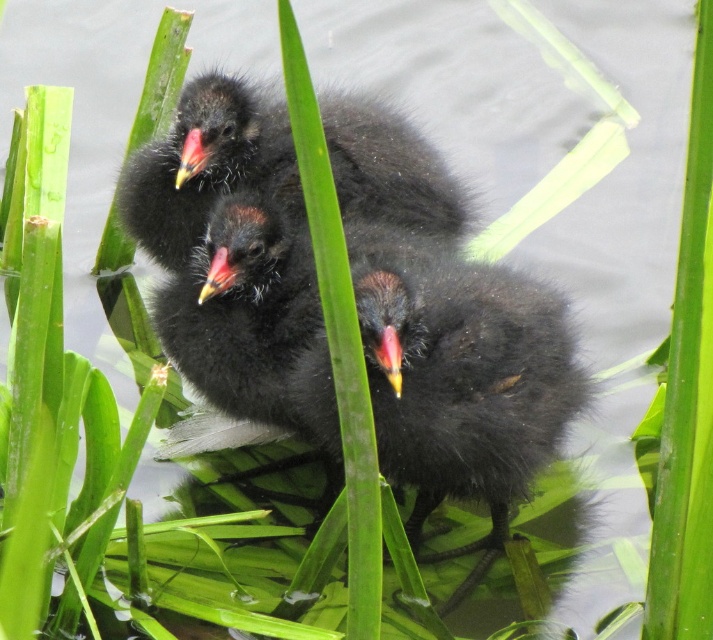
Question: Does black fluffy birds at upper center appear over yellow-orange beak at center?

Choices:
 (A) no
 (B) yes

Answer: (B)

Question: In this image, where is black fluffy birds at upper center located relative to yellow-orange beak at center?

Choices:
 (A) above
 (B) below

Answer: (A)

Question: Among these points, which one is nearest to the camera?

Choices:
 (A) (389, 376)
 (B) (381, 145)

Answer: (A)

Question: Which of the following is the farthest from the observer?

Choices:
 (A) black fluffy birds at upper center
 (B) yellow-orange beak at center

Answer: (A)

Question: Is black fluffy birds at upper center further to camera compared to yellow-orange beak at center?

Choices:
 (A) yes
 (B) no

Answer: (A)